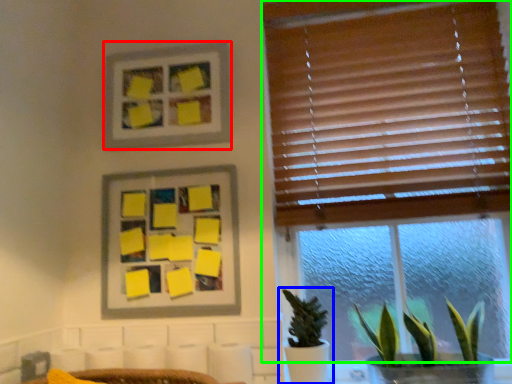
Question: Which is nearer to the picture frame (highlighted by a red box)? houseplant (highlighted by a blue box) or window (highlighted by a green box).

Choices:
 (A) houseplant
 (B) window

Answer: (B)